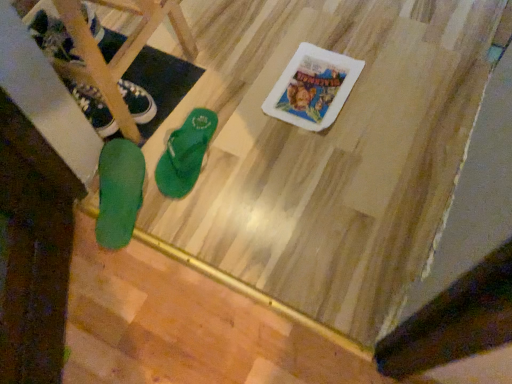
The height and width of the screenshot is (384, 512). In order to click on unoccupied space behind green rubber flip-flop at lower left, which appears as the first footwear when viewed from the left in this screenshot , I will do `click(131, 62)`.